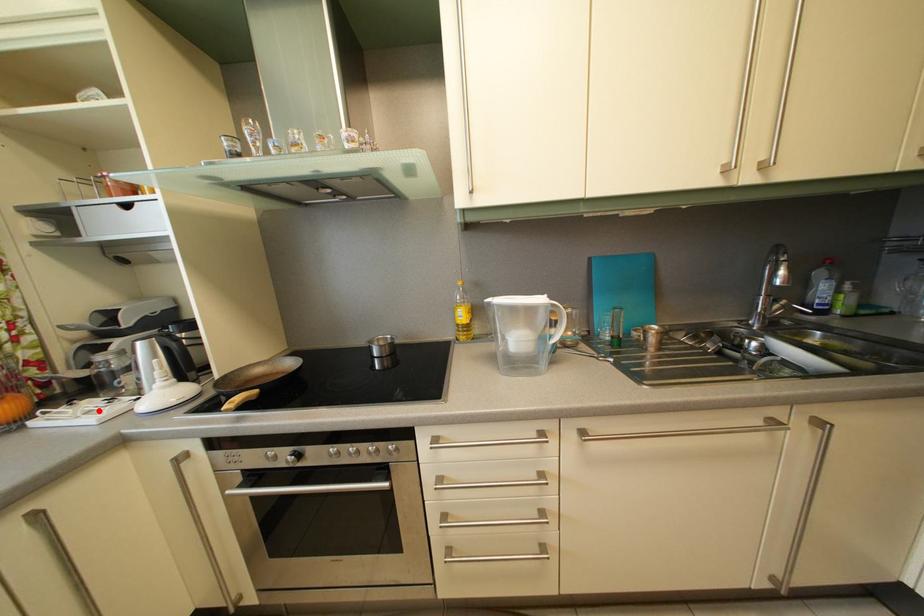
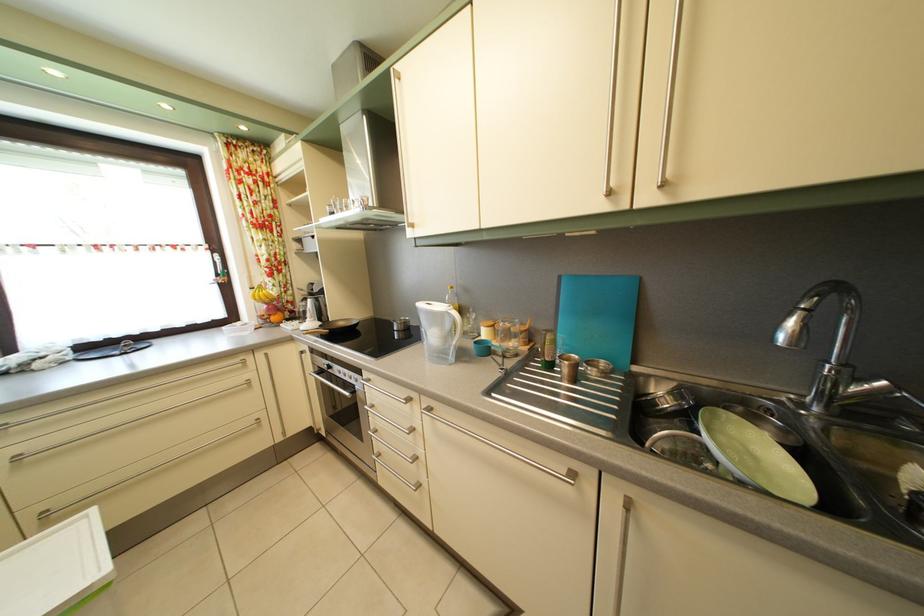
The point at the highlighted location is marked in the first image. Where is the corresponding point in the second image?

(305, 330)